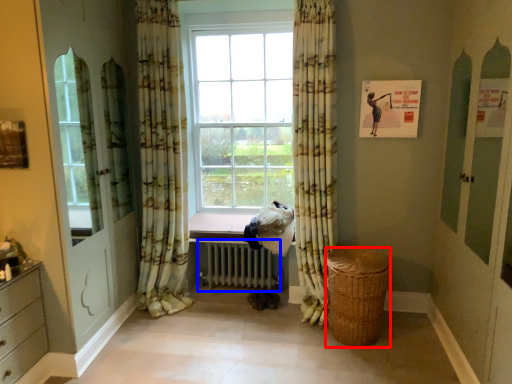
Question: Which point is closer to the camera, basket (highlighted by a red box) or radiator (highlighted by a blue box)?

Choices:
 (A) basket
 (B) radiator

Answer: (A)